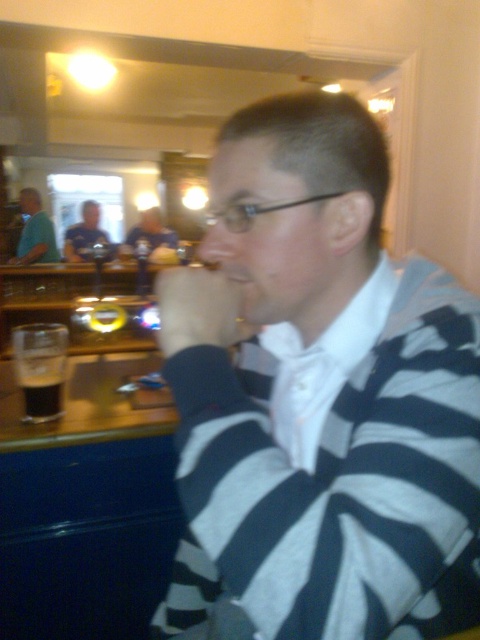
You are a photographer standing in front of the bar counter. You want to take a closeup photo of the dark matte glass at lower left without moving your position. Can you focus on it clearly?

The dark matte glass at lower left is 1.33 meters away from camera, so yes, you can focus on it clearly as it is within the typical focusing range of most cameras.